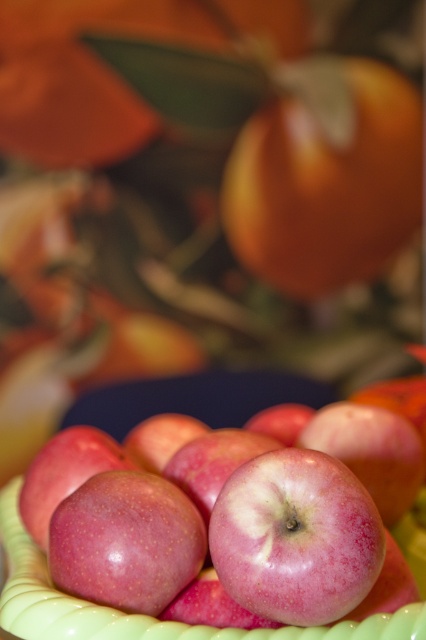
Question: Which object is farther from the camera taking this photo?

Choices:
 (A) pink glossy apple at center
 (B) orange matte tangerine at upper right

Answer: (B)

Question: Based on their relative distances, which object is farther from the orange matte tangerine at upper right?

Choices:
 (A) glossy red apple at center
 (B) pink glossy apple at center

Answer: (B)

Question: Among these points, which one is nearest to the camera?

Choices:
 (A) (267, 260)
 (B) (161, 588)
 (C) (242, 595)

Answer: (C)

Question: Can you confirm if orange matte tangerine at upper right is thinner than pink glossy apple at center?

Choices:
 (A) no
 (B) yes

Answer: (A)

Question: Does glossy red apple at center appear under pink glossy apple at center?

Choices:
 (A) yes
 (B) no

Answer: (B)

Question: Can you confirm if glossy red apple at center is thinner than pink glossy apple at center?

Choices:
 (A) no
 (B) yes

Answer: (A)